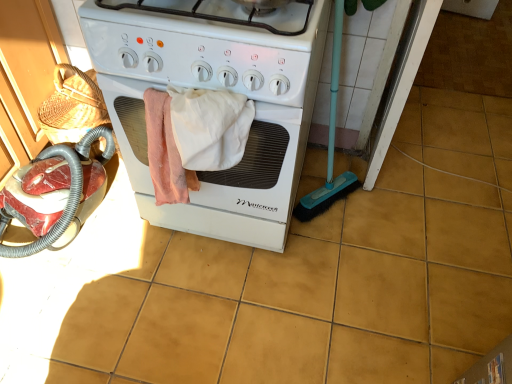
Question: In terms of width, does white glossy gas stove at center look wider or thinner when compared to yellow matte tile at center?

Choices:
 (A) thin
 (B) wide

Answer: (B)

Question: From a real-world perspective, is white glossy gas stove at center above or below yellow matte tile at center?

Choices:
 (A) below
 (B) above

Answer: (B)

Question: Considering the real-world distances, which object is farthest from the yellow matte tile at center?

Choices:
 (A) white matte stove at center
 (B) white glossy gas stove at center
 (C) white cotton towel at center

Answer: (B)

Question: Which object is the farthest from the yellow matte tile at center?

Choices:
 (A) white glossy gas stove at center
 (B) white cotton towel at center
 (C) white matte stove at center

Answer: (A)